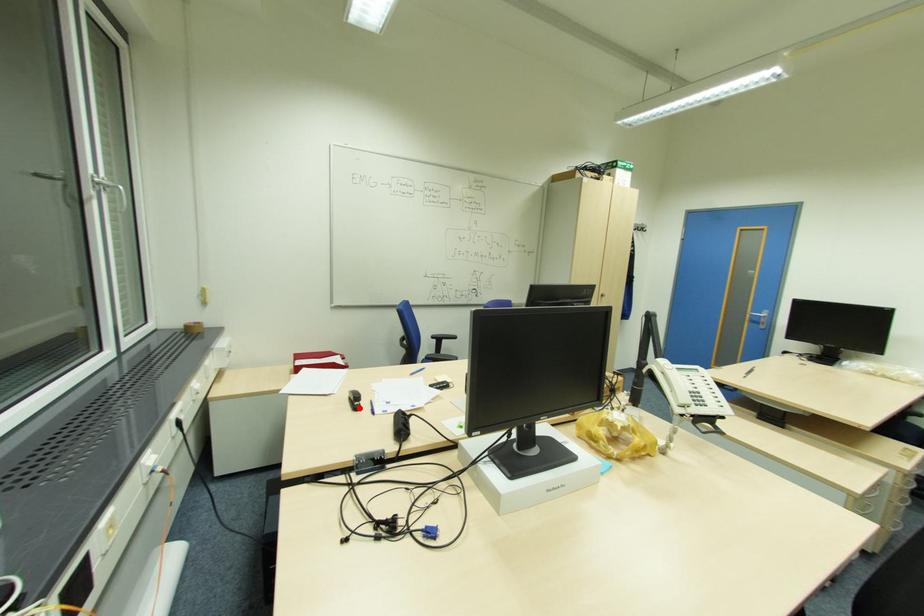
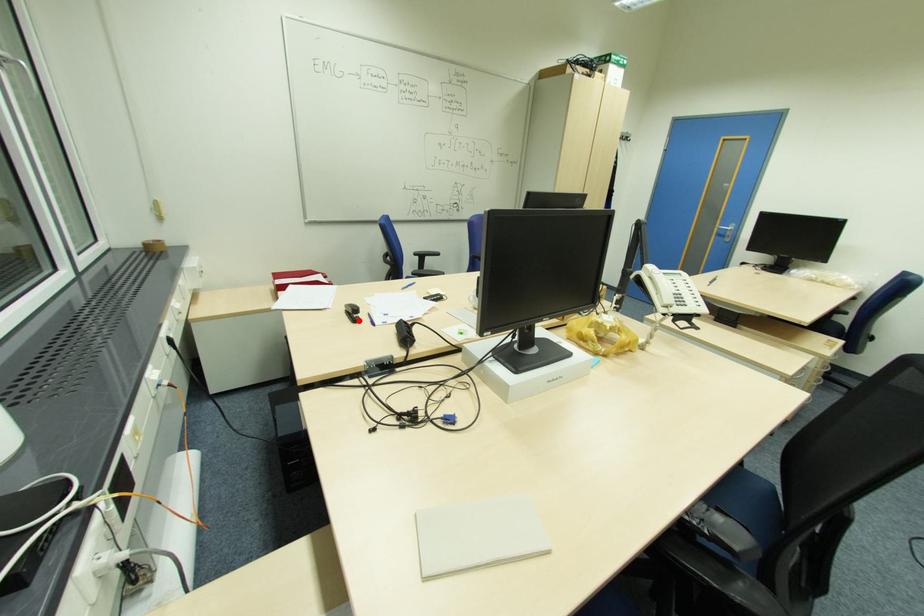
I am providing you with two images of the same scene from different viewpoints. A red point is marked on the first image and another point is marked on the second image. Do the highlighted points in image1 and image2 indicate the same real-world spot?

Yes